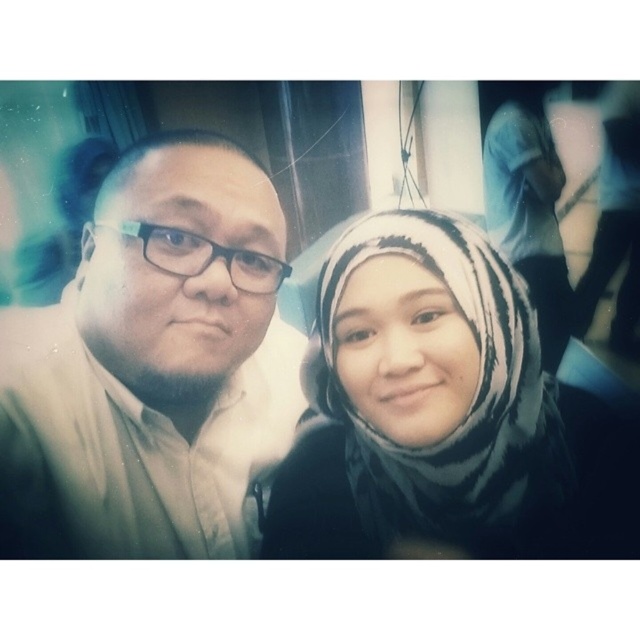
Is black and white patterned hijab at center further to camera compared to white striped scarf at upper right?

No, black and white patterned hijab at center is in front of white striped scarf at upper right.

Between point (296, 449) and point (513, 113), which one is positioned behind?

The point (296, 449) is behind.

Image resolution: width=640 pixels, height=640 pixels. Identify the location of black and white patterned hijab at center. click(x=444, y=436).

Between matte black shirt at center and black and white patterned hijab at center, which one appears on the left side from the viewer's perspective?

matte black shirt at center is more to the left.

Does matte black shirt at center appear over black and white patterned hijab at center?

Correct, matte black shirt at center is located above black and white patterned hijab at center.

Which is in front, point (273, 288) or point (316, 468)?

Point (273, 288)

At what (x,y) coordinates should I click in order to perform the action: click on matte black shirt at center. Please return your answer as a coordinate pair (x, y). This screenshot has height=640, width=640. Looking at the image, I should click on (147, 365).

Where is `matte beige shirt at left`? matte beige shirt at left is located at coordinates (154, 365).

Can you confirm if matte beige shirt at left is shorter than white striped scarf at upper right?

Incorrect, matte beige shirt at left's height does not fall short of white striped scarf at upper right's.

Who is more forward, (152,166) or (529,177)?

Point (152,166)

I want to click on matte beige shirt at left, so click(x=154, y=365).